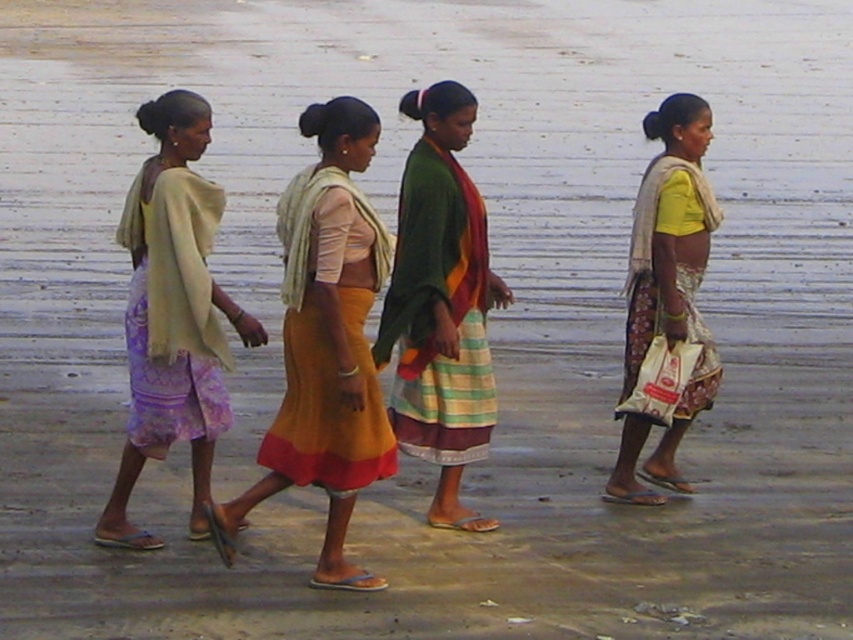
Question: Among these points, which one is nearest to the camera?

Choices:
 (A) (457, 282)
 (B) (378, 438)
 (C) (161, 275)
 (D) (643, 332)

Answer: (B)

Question: Does linen-like beige shawl at left have a lesser width compared to yellow cotton shirt at center?

Choices:
 (A) yes
 (B) no

Answer: (B)

Question: Can you confirm if linen-like beige shawl at left is positioned to the left of green textured shawl at center?

Choices:
 (A) no
 (B) yes

Answer: (B)

Question: Is matte yellow skirt at center above linen-like beige shawl at left?

Choices:
 (A) yes
 (B) no

Answer: (B)

Question: Which object appears farthest from the camera in this image?

Choices:
 (A) yellow cotton shirt at center
 (B) matte yellow skirt at center
 (C) green textured shawl at center
 (D) lavender printed fabric dress at left

Answer: (A)

Question: Which object appears closest to the camera in this image?

Choices:
 (A) yellow cotton shirt at center
 (B) orange cotton dress at center

Answer: (B)